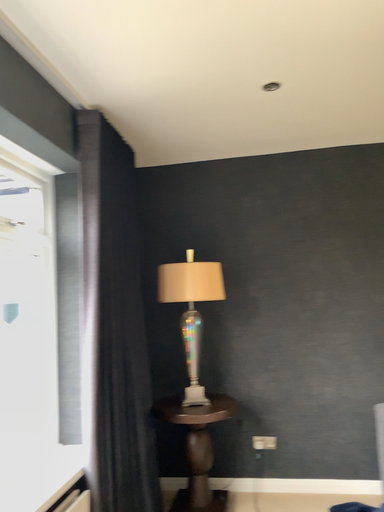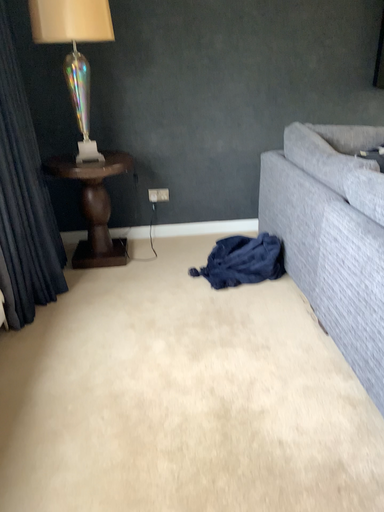
Question: How did the camera likely rotate when shooting the video?

Choices:
 (A) rotated downward
 (B) rotated upward

Answer: (A)